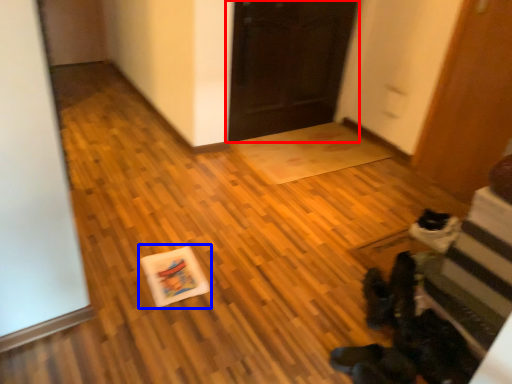
Question: Which point is closer to the camera, door (highlighted by a red box) or postcard (highlighted by a blue box)?

Choices:
 (A) door
 (B) postcard

Answer: (B)